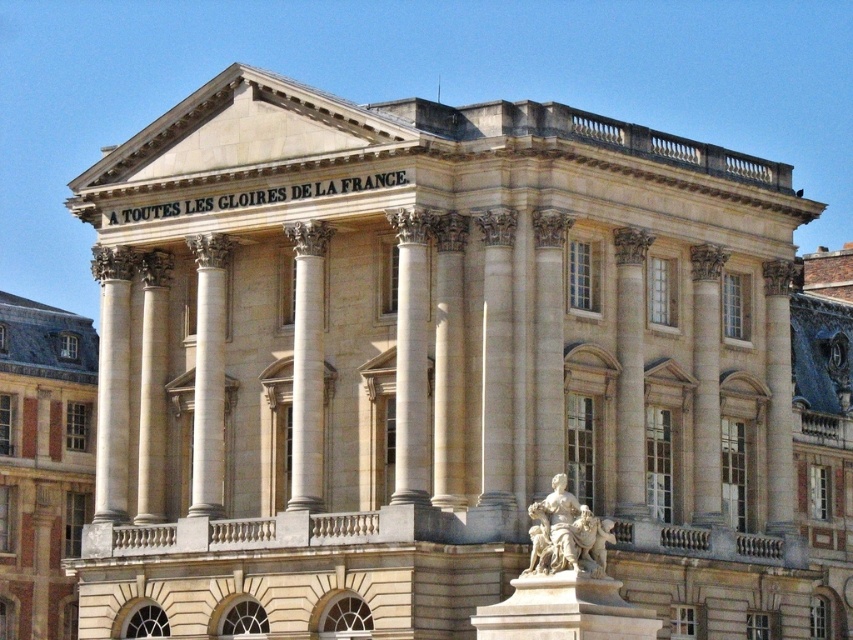
How far apart are beige stone building at left and white marble statue at lower center?

They are 32.73 meters apart.

Who is lower down, beige stone building at left or white marble statue at lower center?

white marble statue at lower center

Where is `beige stone building at left`? beige stone building at left is located at coordinates (42, 461).